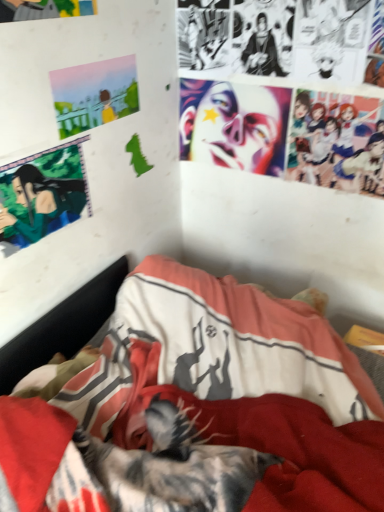
Question: From a real-world perspective, is pastel acrylic painting at upper left under shiny plastic face at upper center?

Choices:
 (A) yes
 (B) no

Answer: (B)

Question: Could you tell me if pastel acrylic painting at upper left is turned towards shiny plastic face at upper center?

Choices:
 (A) yes
 (B) no

Answer: (B)

Question: Considering the relative sizes of pastel acrylic painting at upper left and shiny plastic face at upper center in the image provided, is pastel acrylic painting at upper left thinner than shiny plastic face at upper center?

Choices:
 (A) yes
 (B) no

Answer: (A)

Question: Is shiny plastic face at upper center inside pastel acrylic painting at upper left?

Choices:
 (A) no
 (B) yes

Answer: (A)

Question: Is pastel acrylic painting at upper left at the left side of shiny plastic face at upper center?

Choices:
 (A) yes
 (B) no

Answer: (A)

Question: From the image's perspective, is pastel acrylic painting at upper left under shiny plastic face at upper center?

Choices:
 (A) no
 (B) yes

Answer: (A)

Question: Is green matte anime character at upper left bigger than pastel acrylic painting at upper left?

Choices:
 (A) yes
 (B) no

Answer: (A)

Question: Is green matte anime character at upper left oriented away from pastel acrylic painting at upper left?

Choices:
 (A) yes
 (B) no

Answer: (B)

Question: From a real-world perspective, is green matte anime character at upper left positioned over pastel acrylic painting at upper left based on gravity?

Choices:
 (A) no
 (B) yes

Answer: (A)

Question: Is green matte anime character at upper left surrounding pastel acrylic painting at upper left?

Choices:
 (A) yes
 (B) no

Answer: (B)

Question: Considering the relative sizes of green matte anime character at upper left and pastel acrylic painting at upper left in the image provided, is green matte anime character at upper left wider than pastel acrylic painting at upper left?

Choices:
 (A) no
 (B) yes

Answer: (A)

Question: Is green matte anime character at upper left thinner than pastel acrylic painting at upper left?

Choices:
 (A) no
 (B) yes

Answer: (B)

Question: From a real-world perspective, does shiny plastic face at upper center stand above pastel acrylic painting at upper left?

Choices:
 (A) no
 (B) yes

Answer: (A)